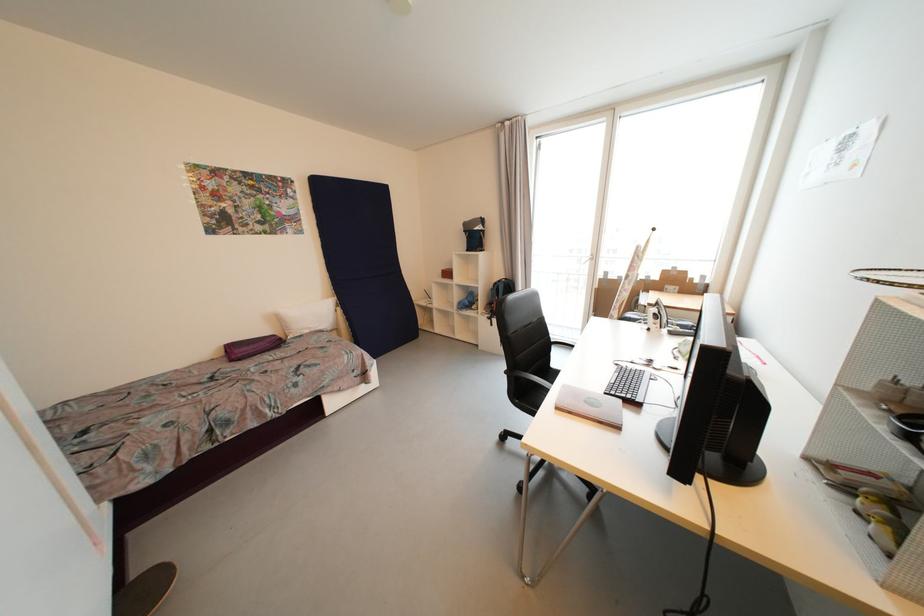
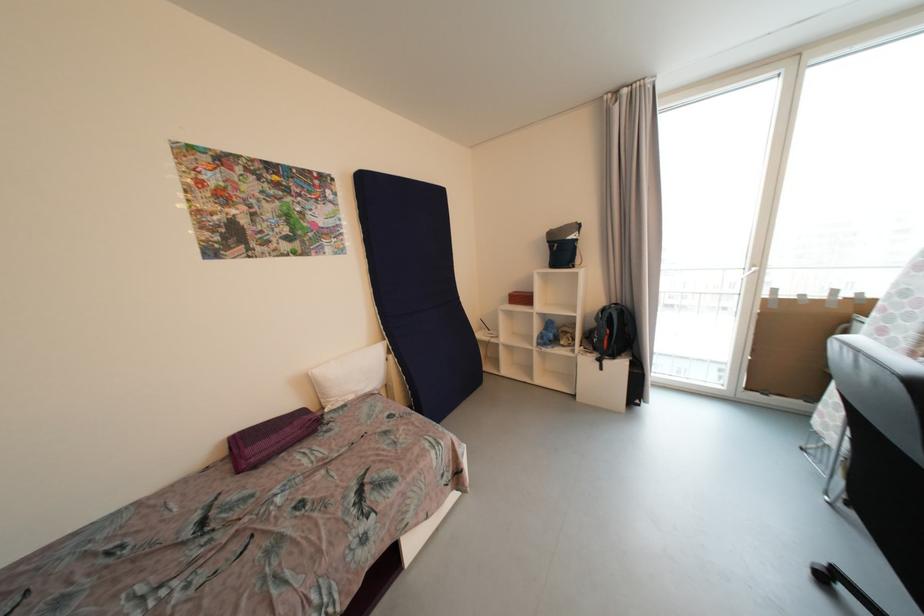
Where in the second image is the point corresponding to point 344,310 from the first image?

(396, 359)